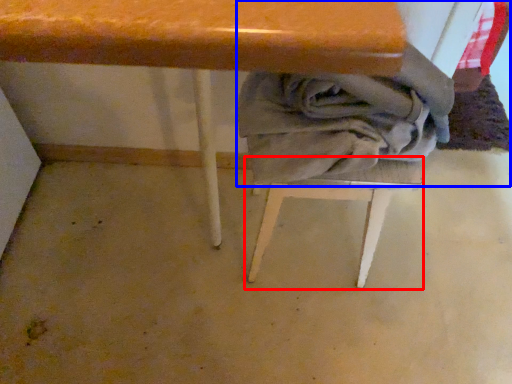
Question: Which object appears closest to the camera in this image, step stool (highlighted by a red box) or laundry (highlighted by a blue box)?

Choices:
 (A) step stool
 (B) laundry

Answer: (B)